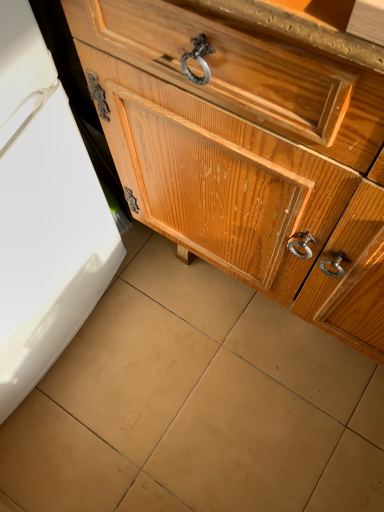
Locate an element on the screen. This screenshot has width=384, height=512. empty space that is ontop of brown matte tile at center is located at coordinates (172, 390).